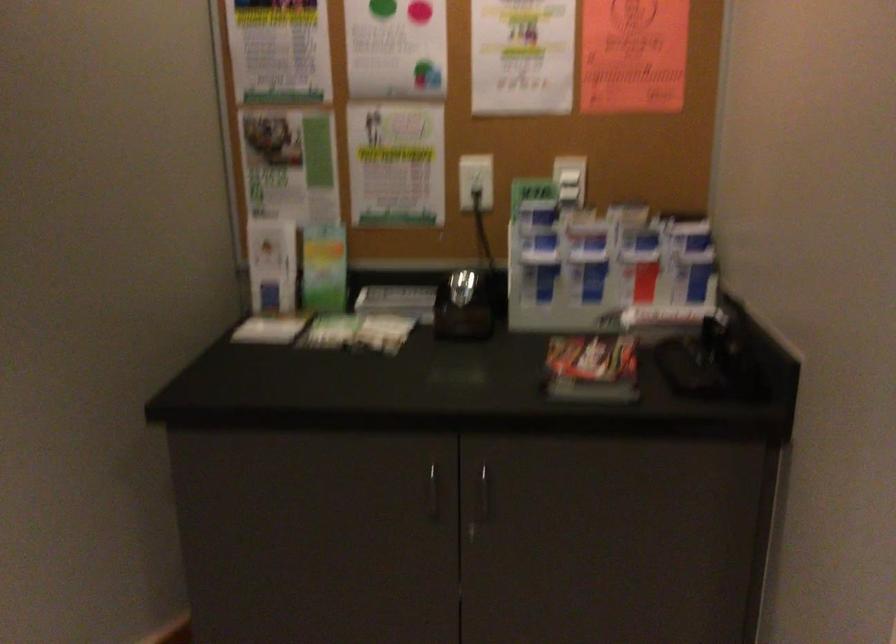
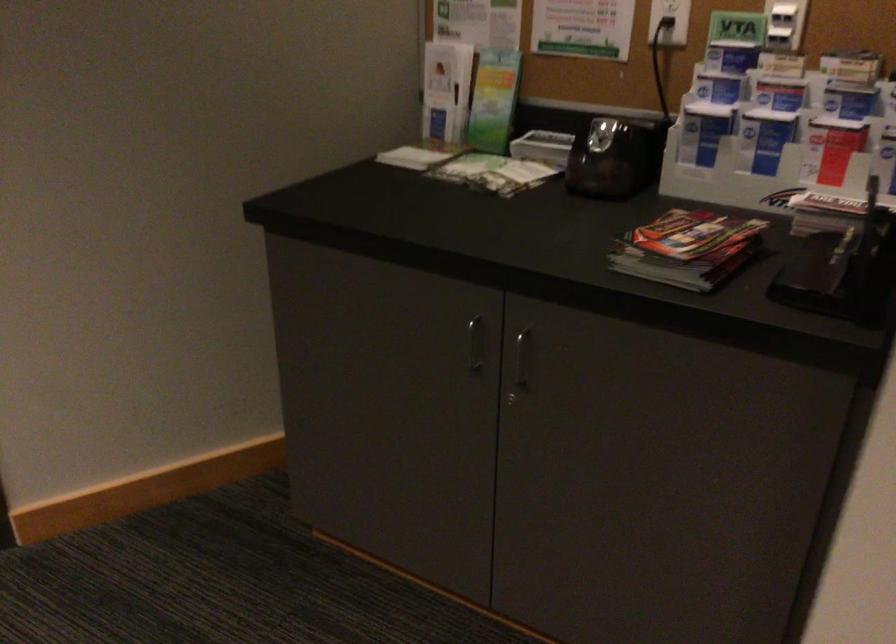
Which direction would the cameraman need to move to produce the second image?

The cameraman moved toward right, forward.